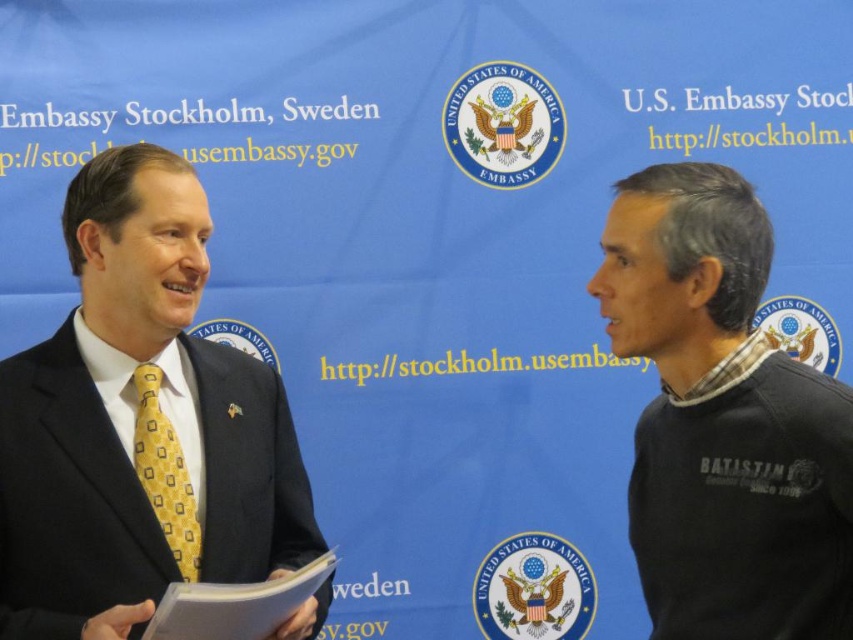
Question: Which point is farther to the camera?

Choices:
 (A) (167, 436)
 (B) (126, 506)
 (C) (724, 291)

Answer: (A)

Question: Is matte black suit at left above dark gray sweater at right?

Choices:
 (A) yes
 (B) no

Answer: (B)

Question: Does matte black suit at left appear over yellow silk tie at left?

Choices:
 (A) no
 (B) yes

Answer: (B)

Question: Among these objects, which one is farthest from the camera?

Choices:
 (A) matte black suit at left
 (B) dark gray sweater at right
 (C) yellow silk tie at left

Answer: (C)

Question: Is matte black suit at left closer to camera compared to yellow silk tie at left?

Choices:
 (A) no
 (B) yes

Answer: (B)

Question: Which object appears closest to the camera in this image?

Choices:
 (A) matte black suit at left
 (B) yellow silk tie at left

Answer: (A)